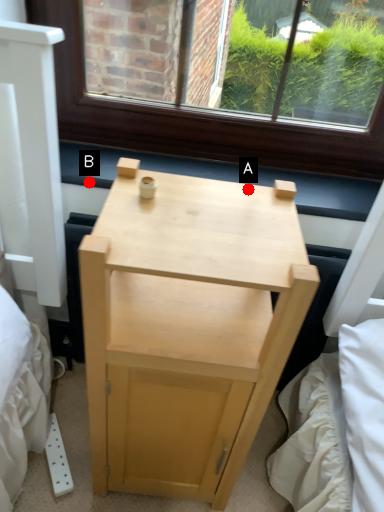
Question: Two points are circled on the image, labeled by A and B beside each circle. Which point is farther from the camera taking this photo?

Choices:
 (A) A is further
 (B) B is further

Answer: (B)